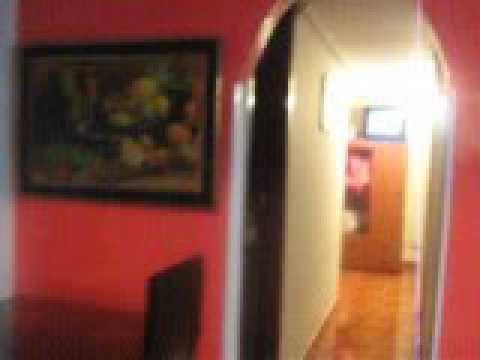
The height and width of the screenshot is (360, 480). I want to click on arched threshold, so click(261, 42), click(422, 18), click(449, 136), click(247, 97).